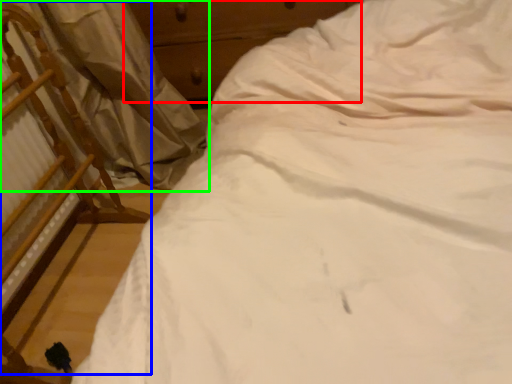
Question: Based on their relative distances, which object is nearer to dresser (highlighted by a red box)? Choose from chair (highlighted by a blue box) and curtain (highlighted by a green box).

Choices:
 (A) chair
 (B) curtain

Answer: (B)